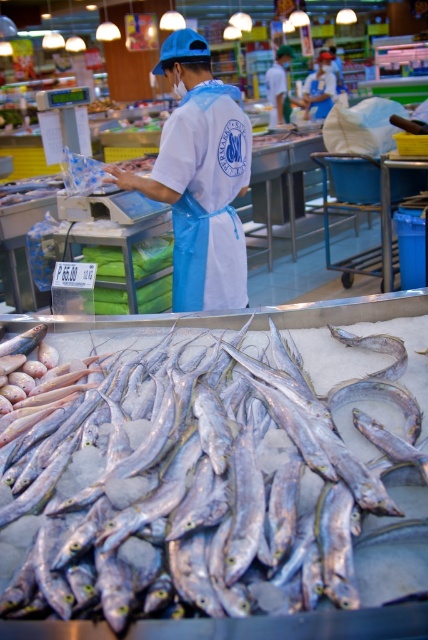
You are a customer at the fish market and want to know which item is closer to you between the silvery metallic fish at center and the blue apron at center. Based on their positions, which one would you say is nearer?

The silvery metallic fish at center is shorter than the blue apron at center, meaning it is closer to you.

Based on the photo, you are a customer at the fish market and want to pick up the silvery metallic fish at center. If your hand can reach up to 20 inches, can you safely grab it without moving closer?

The silvery metallic fish at center and viewer are 21.20 inches apart, so your hand can only reach up to 20 inches. You need to move closer to grab it safely.